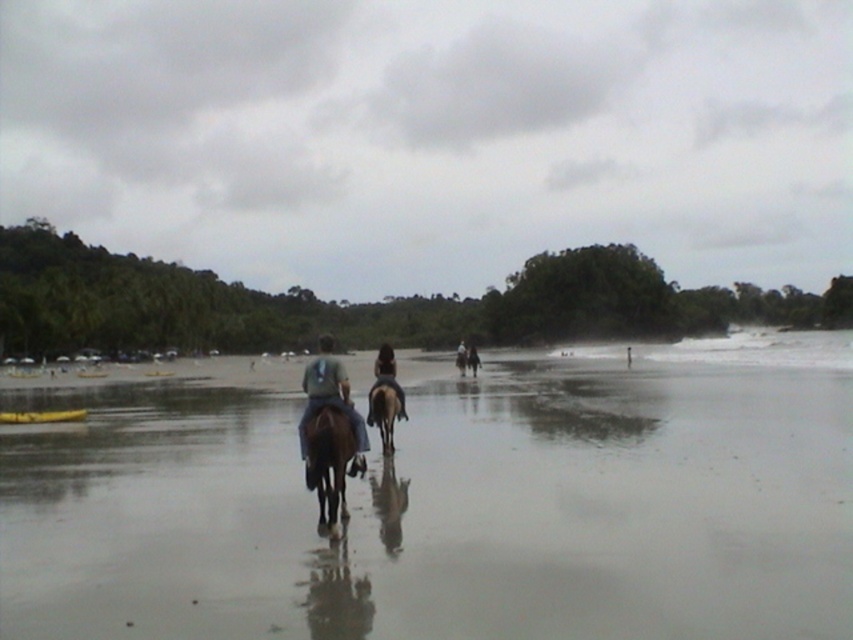
Is blue denim jeans at center wider than dark blue jeans at center?

No, blue denim jeans at center is not wider than dark blue jeans at center.

Is blue denim jeans at center thinner than dark blue jeans at center?

Correct, blue denim jeans at center's width is less than dark blue jeans at center's.

Is point (329, 378) closer to viewer compared to point (474, 362)?

Yes, point (329, 378) is closer to viewer.

You are a GUI agent. You are given a task and a screenshot of the screen. Output one action in this format:
    pyautogui.click(x=<x>, y=<y>)
    Task: Click on the blue denim jeans at center
    
    Given the screenshot: What is the action you would take?
    pyautogui.click(x=329, y=404)

Between point (392, 378) and point (457, 362), which one is positioned in front?

Positioned in front is point (392, 378).

Describe the element at coordinates (386, 380) in the screenshot. Image resolution: width=853 pixels, height=640 pixels. I see `dark brown leather horse at center` at that location.

You are a GUI agent. You are given a task and a screenshot of the screen. Output one action in this format:
    pyautogui.click(x=<x>, y=<y>)
    Task: Click on the dark brown leather horse at center
    The height and width of the screenshot is (640, 853).
    Given the screenshot: What is the action you would take?
    pyautogui.click(x=386, y=380)

Is point (469, 364) farther from viewer compared to point (463, 342)?

No.

Looking at this image, is dark blue jeans at center above dark brown leather jacket at center?

No.

Is point (467, 355) more distant than point (456, 356)?

No, it is in front of (456, 356).

At what (x,y) coordinates should I click in order to perform the action: click on dark blue jeans at center. Please return your answer as a coordinate pair (x, y). This screenshot has height=640, width=853. Looking at the image, I should click on (473, 358).